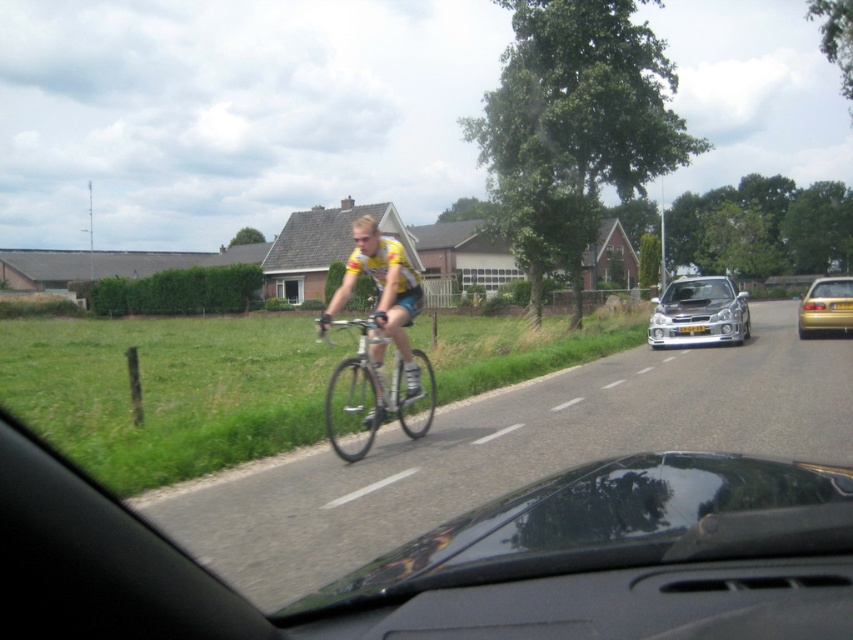
Question: Among these objects, which one is farthest from the camera?

Choices:
 (A) gold metallic car at right
 (B) silver metallic car at center-right
 (C) silver metallic bicycle at center

Answer: (B)

Question: Can you confirm if silver metallic bicycle at center is positioned to the left of gold metallic car at right?

Choices:
 (A) yes
 (B) no

Answer: (A)

Question: Which of these objects is positioned farthest from the silver metallic car at center-right?

Choices:
 (A) silver metallic bicycle at center
 (B) gold metallic car at right

Answer: (A)

Question: Observing the image, what is the correct spatial positioning of silver metallic car at center-right in reference to gold metallic car at right?

Choices:
 (A) left
 (B) right

Answer: (A)

Question: Does silver metallic bicycle at center appear on the right side of gold metallic car at right?

Choices:
 (A) no
 (B) yes

Answer: (A)

Question: Which object is the farthest from the silver metallic bicycle at center?

Choices:
 (A) gold metallic car at right
 (B) silver metallic car at center-right

Answer: (A)